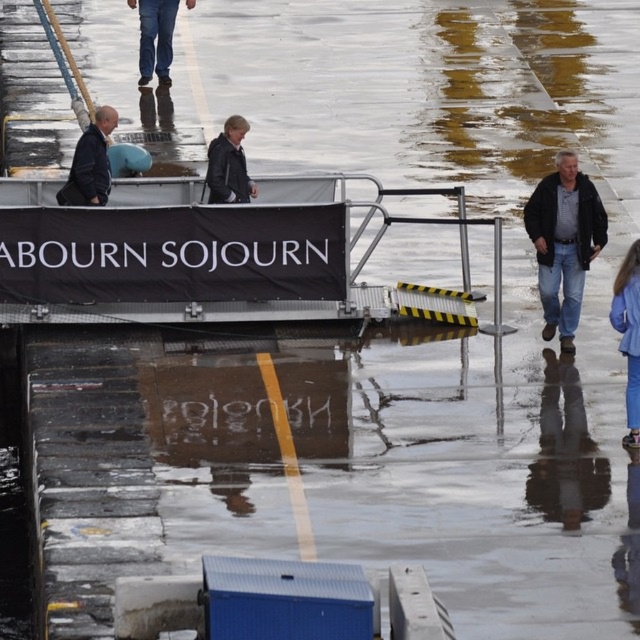
Question: Considering the relative positions of dark blue leather jacket at upper left and dark gray leather jacket at center in the image provided, where is dark blue leather jacket at upper left located with respect to dark gray leather jacket at center?

Choices:
 (A) above
 (B) below

Answer: (B)

Question: Which object is positioned farthest from the dark gray leather jacket at center?

Choices:
 (A) denim jacket at right
 (B) blue denim jeans at lower right
 (C) denim jeans at upper center
 (D) dark blue leather jacket at upper left

Answer: (C)

Question: Can you confirm if blue denim jeans at lower right is smaller than dark blue leather jacket at upper left?

Choices:
 (A) no
 (B) yes

Answer: (B)

Question: Which of the following is the closest to the observer?

Choices:
 (A) blue denim jeans at lower right
 (B) denim jeans at upper center
 (C) dark blue leather jacket at upper left

Answer: (A)

Question: Among these objects, which one is farthest from the camera?

Choices:
 (A) dark gray leather jacket at center
 (B) denim jeans at upper center
 (C) blue denim jeans at lower right
 (D) dark blue leather jacket at upper left

Answer: (B)

Question: Does blue denim jeans at lower right appear on the right side of dark blue leather jacket at upper left?

Choices:
 (A) yes
 (B) no

Answer: (A)